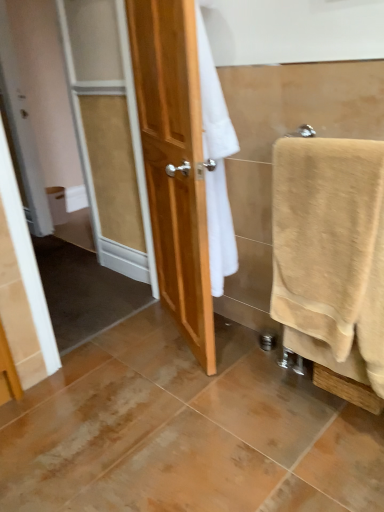
Describe the element at coordinates (330, 253) in the screenshot. I see `beige cotton towel at right` at that location.

This screenshot has height=512, width=384. I want to click on beige cotton towel at right, so click(x=330, y=253).

This screenshot has width=384, height=512. What do you see at coordinates (65, 202) in the screenshot? I see `white matte toilet paper at left` at bounding box center [65, 202].

In order to click on white matte toilet paper at left in this screenshot , I will do `click(65, 202)`.

This screenshot has height=512, width=384. I want to click on beige cotton towel at right, so click(330, 253).

Considering the positions of objects beige cotton towel at right and white matte toilet paper at left in the image provided, who is more to the left, beige cotton towel at right or white matte toilet paper at left?

Positioned to the left is white matte toilet paper at left.

Who is more distant, beige cotton towel at right or white matte toilet paper at left?

white matte toilet paper at left.

Does point (307, 356) appear closer or farther from the camera than point (80, 198)?

Point (307, 356).

From the image's perspective, which one is positioned lower, beige cotton towel at right or white matte toilet paper at left?

From the image's view, beige cotton towel at right is below.

From a real-world perspective, which object stands above the other?

beige cotton towel at right.

Does beige cotton towel at right have a greater width compared to white matte toilet paper at left?

Correct, the width of beige cotton towel at right exceeds that of white matte toilet paper at left.

Can you confirm if beige cotton towel at right is shorter than white matte toilet paper at left?

No.

Is beige cotton towel at right bigger or smaller than white matte toilet paper at left?

In the image, beige cotton towel at right appears to be larger than white matte toilet paper at left.

Is beige cotton towel at right completely or partially outside of white matte toilet paper at left?

Yes.

Are beige cotton towel at right and white matte toilet paper at left making contact?

No, beige cotton towel at right is not touching white matte toilet paper at left.

Is beige cotton towel at right looking in the opposite direction of white matte toilet paper at left?

No, beige cotton towel at right's orientation is not away from white matte toilet paper at left.

Based on the photo, how many degrees apart are the facing directions of beige cotton towel at right and white matte toilet paper at left?

The facing directions of beige cotton towel at right and white matte toilet paper at left are 90.1 degrees apart.

How much distance is there between beige cotton towel at right and white matte toilet paper at left?

beige cotton towel at right and white matte toilet paper at left are 2.63 meters apart from each other.

Where is `towel above the white matte toilet paper at left (from a real-world perspective)`? Image resolution: width=384 pixels, height=512 pixels. towel above the white matte toilet paper at left (from a real-world perspective) is located at coordinates (330, 253).

Is white matte toilet paper at left at the right side of beige cotton towel at right?

Incorrect, white matte toilet paper at left is not on the right side of beige cotton towel at right.

Is white matte toilet paper at left further to the viewer compared to beige cotton towel at right?

Yes, white matte toilet paper at left is further from the viewer.

Does point (84, 189) appear closer or farther from the camera than point (319, 146)?

Point (84, 189).

From the image's perspective, is white matte toilet paper at left above beige cotton towel at right?

Correct, white matte toilet paper at left appears higher than beige cotton towel at right in the image.

From a real-world perspective, is white matte toilet paper at left positioned above or below beige cotton towel at right?

white matte toilet paper at left is below beige cotton towel at right.

Which of these two, white matte toilet paper at left or beige cotton towel at right, is wider?

beige cotton towel at right is wider.

Is white matte toilet paper at left taller or shorter than beige cotton towel at right?

In the image, white matte toilet paper at left appears to be shorter than beige cotton towel at right.

Can you confirm if white matte toilet paper at left is smaller than beige cotton towel at right?

Yes.

From the picture: Is beige cotton towel at right located within white matte toilet paper at left?

That's incorrect, beige cotton towel at right is not inside white matte toilet paper at left.

Is white matte toilet paper at left not near beige cotton towel at right?

A: Yes, white matte toilet paper at left and beige cotton towel at right are quite far apart.

Is white matte toilet paper at left oriented towards beige cotton towel at right?

Yes.

Measure the distance between white matte toilet paper at left and beige cotton towel at right.

white matte toilet paper at left and beige cotton towel at right are 8.63 feet apart from each other.

You are a GUI agent. You are given a task and a screenshot of the screen. Output one action in this format:
    pyautogui.click(x=<x>, y=<y>)
    Task: Click on the towel above the white matte toilet paper at left (from a real-world perspective)
    This screenshot has height=512, width=384.
    Given the screenshot: What is the action you would take?
    pyautogui.click(x=330, y=253)

Where is `towel located above the white matte toilet paper at left (from a real-world perspective)`? towel located above the white matte toilet paper at left (from a real-world perspective) is located at coordinates (330, 253).

Identify the location of toilet paper lying above the beige cotton towel at right (from the image's perspective). The image size is (384, 512). (65, 202).